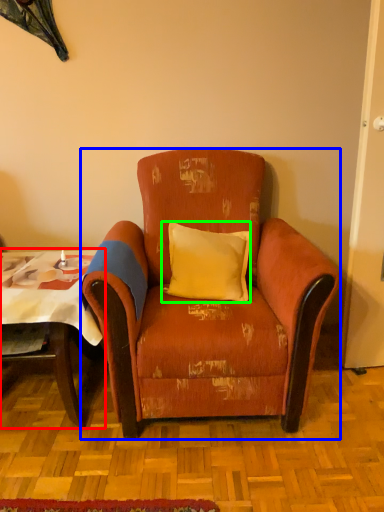
Question: Which object is positioned closest to table (highlighted by a red box)? Select from chair (highlighted by a blue box) and pillow (highlighted by a green box).

Choices:
 (A) chair
 (B) pillow

Answer: (A)